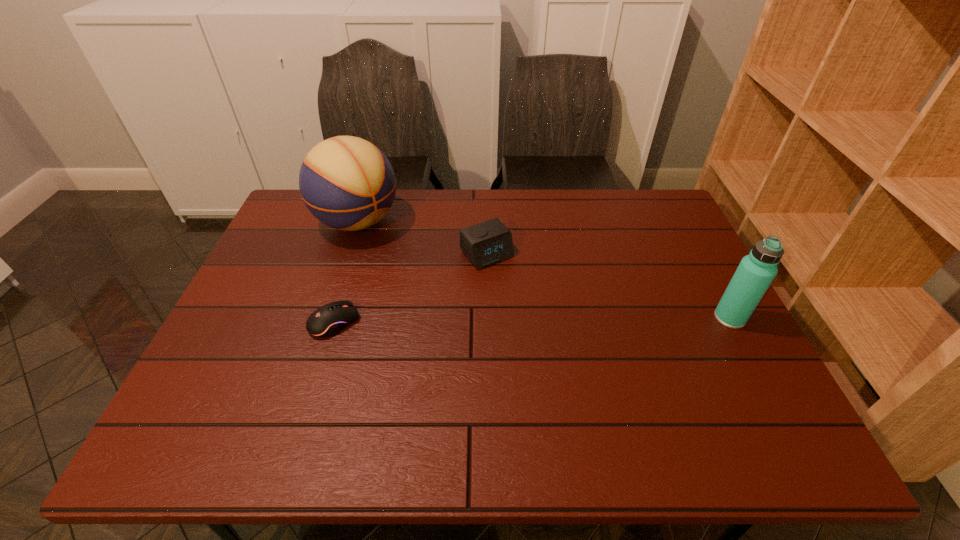
Image resolution: width=960 pixels, height=540 pixels. I want to click on free space that satisfies the following two spatial constraints: 1. on the front side of the computer mouse; 2. on the left side of the basketball, so click(x=324, y=322).